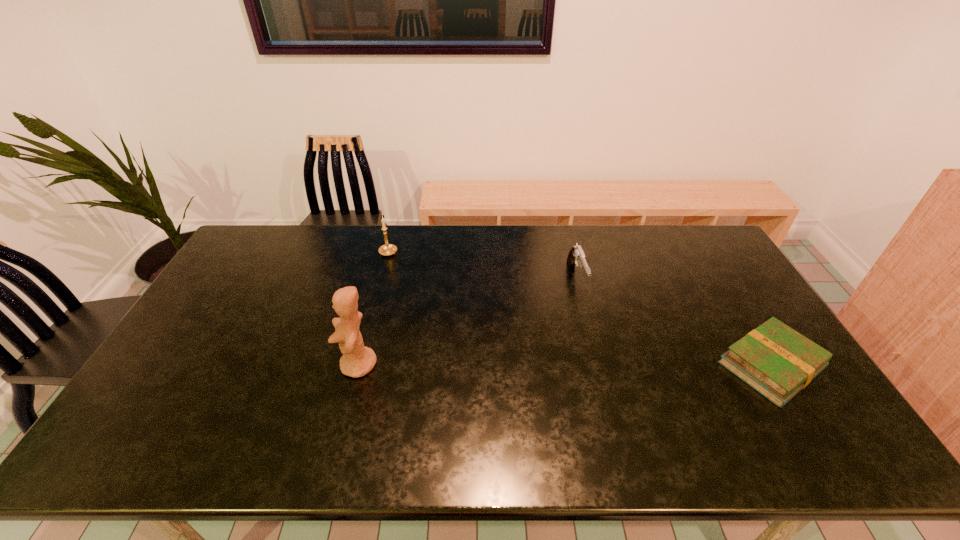
You are a GUI agent. You are given a task and a screenshot of the screen. Output one action in this format:
    pyautogui.click(x=<x>, y=<y>)
    Task: Click on the free space on the desktop that is between the tallest object and the rightmost object and is positioned on the handle side of the candle holder
    This screenshot has height=540, width=960.
    Given the screenshot: What is the action you would take?
    tap(530, 365)

The height and width of the screenshot is (540, 960). I want to click on free spot on the desktop that is between the figurine and the rightmost object and is positioned at the muzzle of the second shortest object, so click(613, 365).